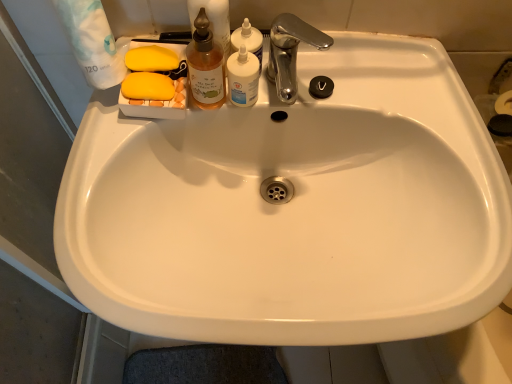
In order to click on vacant area located to the right-hand side of white opaque bottle at upper center in this screenshot , I will do `click(369, 81)`.